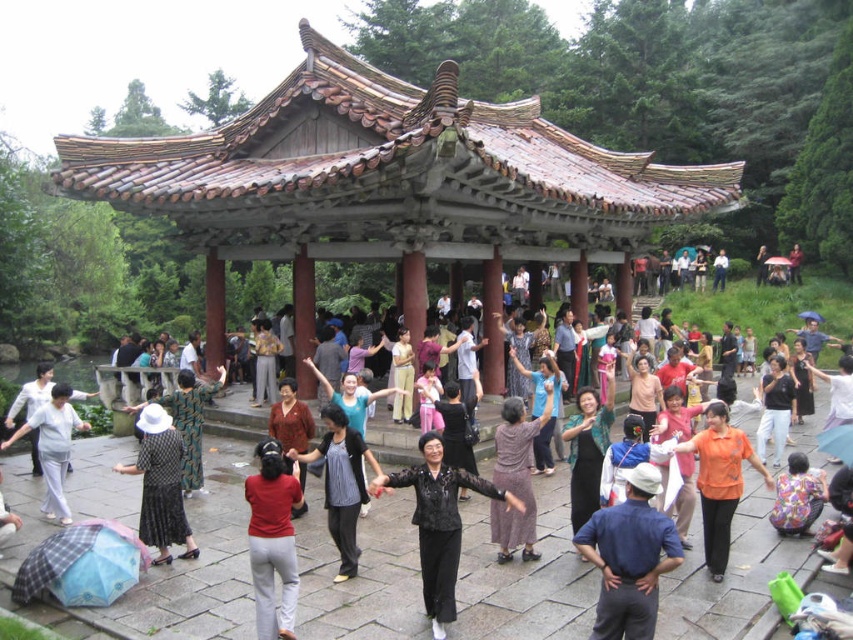
You are a photographer standing in front of the pavilion. You notice a person wearing a blue cotton shirt at center and black matte pants at center. Which clothing item is higher on their body?

The blue cotton shirt at center is above the black matte pants at center, so the blue cotton shirt at center is higher on their body.